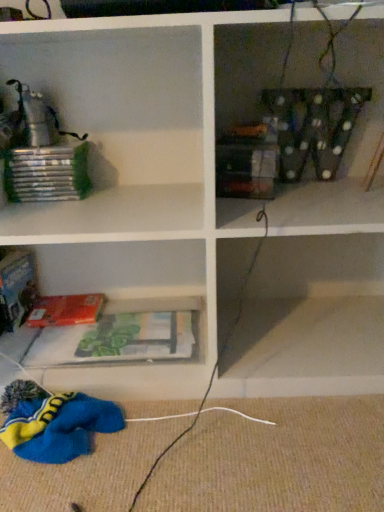
Locate an element on the screen. free space in front of matte plastic books at lower center is located at coordinates (134, 395).